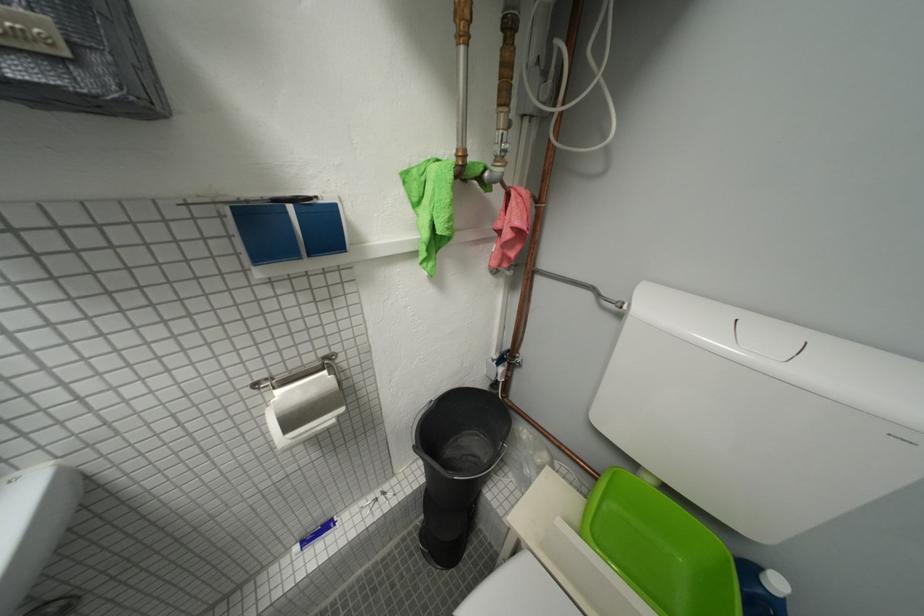
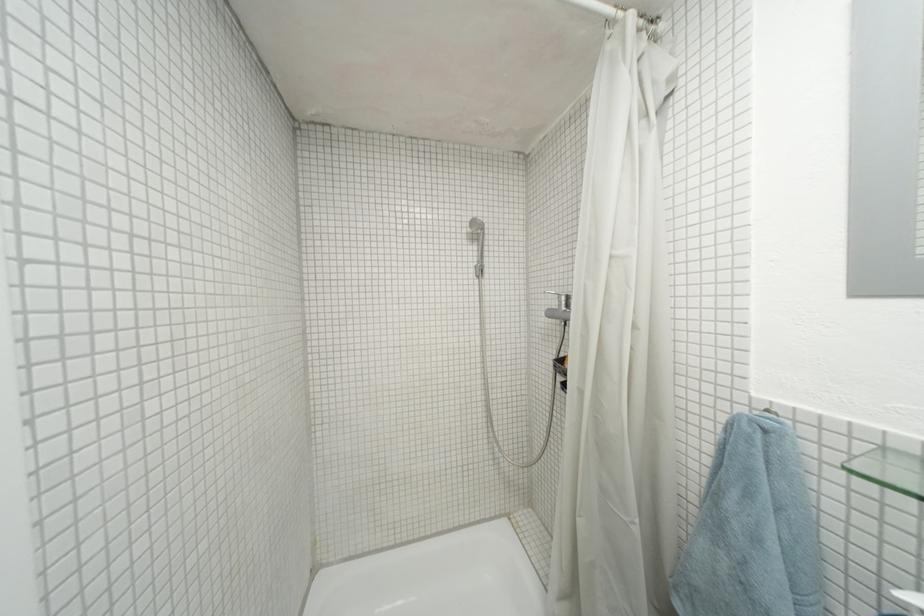
Question: The camera is either moving clockwise (left) or counter-clockwise (right) around the object. The first image is from the beginning of the video and the second image is from the end. Is the camera moving left or right when shooting the video?

Choices:
 (A) Left
 (B) Right

Answer: (B)